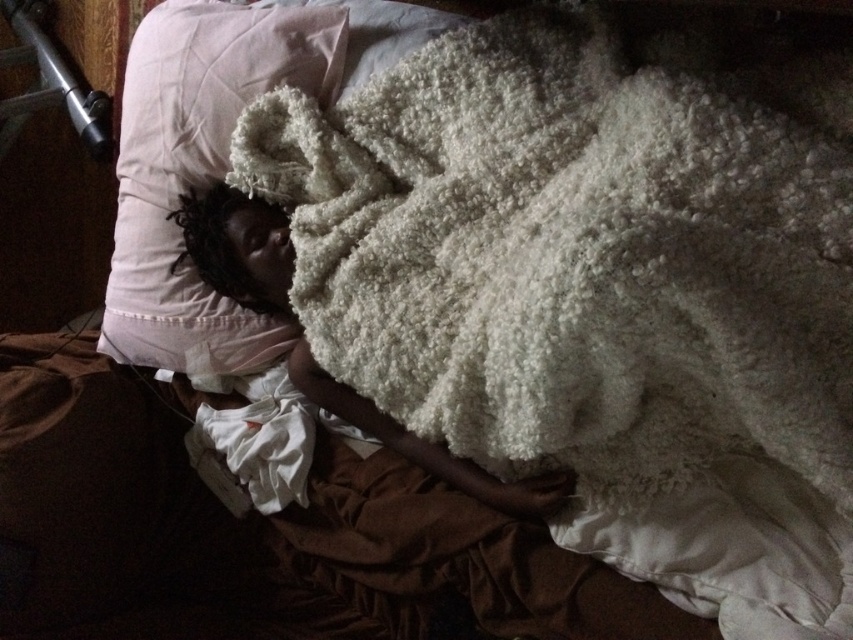
Looking at this image, does white soft pillow at upper left have a larger size compared to white fluffy blanket at center?

No, white soft pillow at upper left is not bigger than white fluffy blanket at center.

Between white soft pillow at upper left and white fluffy blanket at center, which one appears on the left side from the viewer's perspective?

Positioned to the left is white soft pillow at upper left.

The height and width of the screenshot is (640, 853). Describe the element at coordinates (198, 168) in the screenshot. I see `white soft pillow at upper left` at that location.

At what (x,y) coordinates should I click in order to perform the action: click on white soft pillow at upper left. Please return your answer as a coordinate pair (x, y). Looking at the image, I should click on (198, 168).

Which is above, white fluffy blanket at upper center or white fluffy blanket at center?

white fluffy blanket at upper center is higher up.

I want to click on white fluffy blanket at upper center, so click(592, 298).

Is white fluffy blanket at upper center taller than white soft pillow at upper left?

Yes.

Does point (668, 445) come in front of point (219, 28)?

Yes.

Find the location of a particular element. The height and width of the screenshot is (640, 853). white fluffy blanket at upper center is located at coordinates (592, 298).